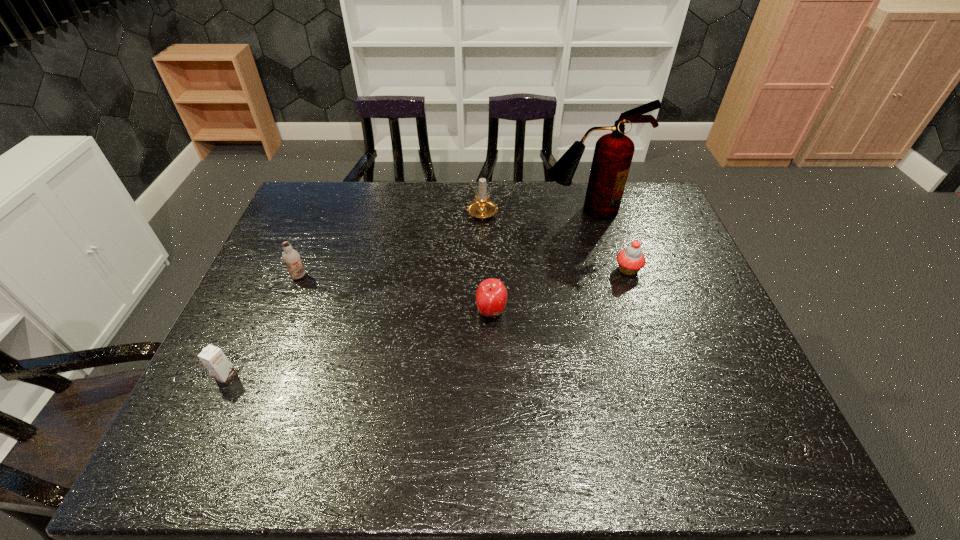
Locate an element on the screen. free space at the near edge of the desktop is located at coordinates (282, 463).

The height and width of the screenshot is (540, 960). In the image, there is a desktop. Find the location of `vacant area at the left edge`. vacant area at the left edge is located at coordinates (279, 272).

In the image, there is a desktop. Identify the location of vacant space at the right edge. (694, 315).

The height and width of the screenshot is (540, 960). In the image, there is a desktop. What are the coordinates of `vacant region at the far left corner` in the screenshot? It's located at (294, 218).

Where is `vacant space at the far right corner of the desktop`? The width and height of the screenshot is (960, 540). vacant space at the far right corner of the desktop is located at coordinates (663, 218).

You are a GUI agent. You are given a task and a screenshot of the screen. Output one action in this format:
    pyautogui.click(x=<x>, y=<y>)
    Task: Click on the free spot at the near right corner of the desktop
    The height and width of the screenshot is (540, 960).
    Given the screenshot: What is the action you would take?
    pyautogui.click(x=765, y=439)

Find the location of `vacant space that's between the tallest object and the shorter chocolate milk`. vacant space that's between the tallest object and the shorter chocolate milk is located at coordinates (407, 293).

The height and width of the screenshot is (540, 960). What are the coordinates of `vacant area that lies between the cupcake and the fire extinguisher` in the screenshot? It's located at (608, 240).

Locate an element on the screen. This screenshot has height=540, width=960. vacant region between the apple and the cupcake is located at coordinates (560, 291).

I want to click on free space between the shorter chocolate milk and the cupcake, so click(427, 323).